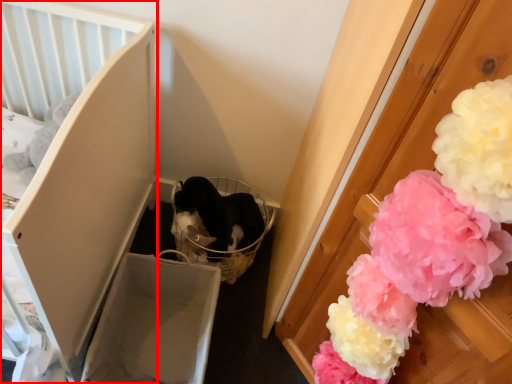
Question: Where is furniture (annotated by the red box) located in relation to flower in the image?

Choices:
 (A) right
 (B) left

Answer: (B)